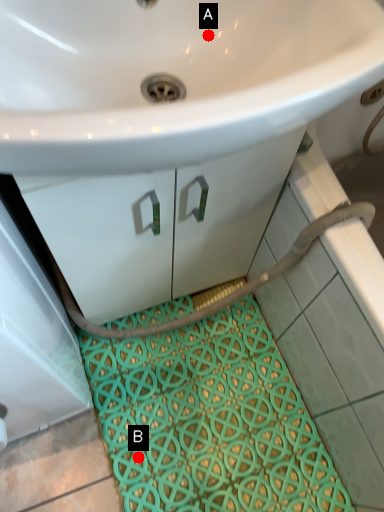
Question: Two points are circled on the image, labeled by A and B beside each circle. Which point appears closest to the camera in this image?

Choices:
 (A) A is closer
 (B) B is closer

Answer: (A)